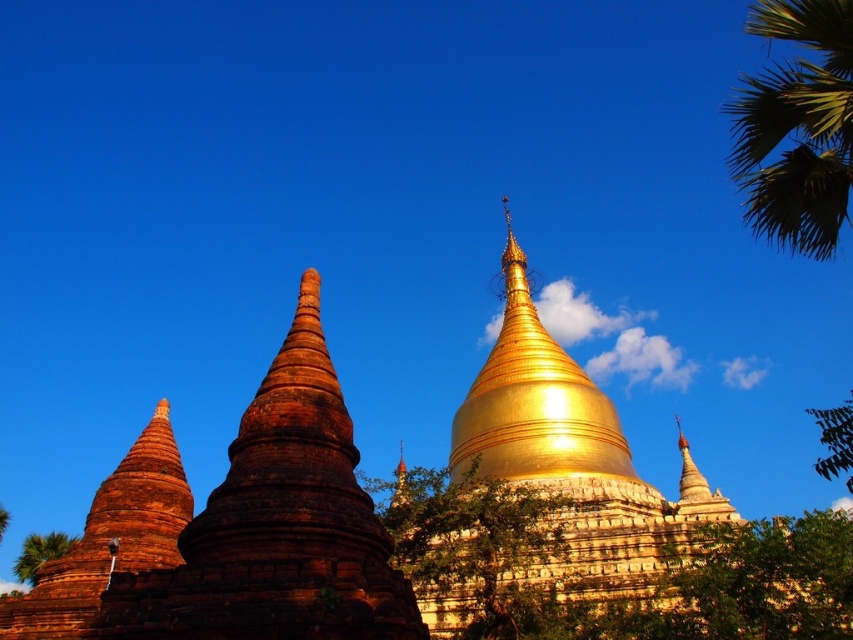
Based on the photo, you are a bird flying over the scene and want to land on the highest point between the green leafy tree at center and the polished wood spire at center. Which one should you choose?

The polished wood spire at center is higher than the green leafy tree at center, so you should choose the polished wood spire at center.

You are a landscape architect designing a garden path that needs to pass between the green leafy tree at center and the polished wood spire at center. Based on their widths, which one should you consider for ensuring the path is wide enough?

The green leafy tree at center might be wider than polished wood spire at center, so you should consider the width of the green leafy tree at center to ensure the path is wide enough.